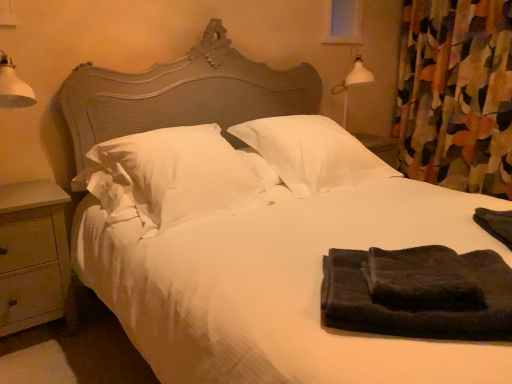
The width and height of the screenshot is (512, 384). What do you see at coordinates (496, 224) in the screenshot?
I see `dark green towel at right, the 2th material in the front-to-back sequence` at bounding box center [496, 224].

Find the location of a particular element. The width and height of the screenshot is (512, 384). wooden at left is located at coordinates (34, 256).

Locate an element on the screen. The height and width of the screenshot is (384, 512). dark green towel at right, which appears as the 1th material when viewed from the back is located at coordinates (496, 224).

Would you say transparent glass window screen at upper center contains white soft pillow at center, which appears as the 2th pillow when viewed from the left?

No, white soft pillow at center, which appears as the 2th pillow when viewed from the left, is not inside transparent glass window screen at upper center.

Which is more to the left, transparent glass window screen at upper center or white soft pillow at center, which appears as the first pillow when viewed from the right?

From the viewer's perspective, white soft pillow at center, which appears as the first pillow when viewed from the right, appears more on the left side.

From a real-world perspective, is transparent glass window screen at upper center physically located above or below white soft pillow at center, which appears as the first pillow when viewed from the right?

transparent glass window screen at upper center is above white soft pillow at center, which appears as the first pillow when viewed from the right.

From the image's perspective, which one is positioned lower, floral fabric curtain at right or dark green towel at right, acting as the 1th material starting from the right?

dark green towel at right, acting as the 1th material starting from the right, from the image's perspective.

Locate an element on the screen. curtain behind the dark green towel at right, the 2th material in the front-to-back sequence is located at coordinates (456, 94).

Looking at the image, does floral fabric curtain at right seem bigger or smaller compared to dark green towel at right, the 2th material in the front-to-back sequence?

Clearly, floral fabric curtain at right is larger in size than dark green towel at right, the 2th material in the front-to-back sequence.

Does floral fabric curtain at right lie in front of dark green towel at right, which is counted as the 2th material, starting from the left?

No, it is not.

What's the angular difference between black terry towel at lower right, marked as the 2th material in a back-to-front arrangement, and floral fabric curtain at right's facing directions?

black terry towel at lower right, marked as the 2th material in a back-to-front arrangement, and floral fabric curtain at right are facing 42.5 degrees away from each other.

Which is more to the right, black terry towel at lower right, which is the first material from front to back, or floral fabric curtain at right?

floral fabric curtain at right.

Which is behind, point (466, 332) or point (438, 148)?

The point (438, 148) is behind.

This screenshot has height=384, width=512. I want to click on curtain located on the right of black terry towel at lower right, arranged as the first material when viewed from the left, so click(456, 94).

Can you confirm if white soft pillow at center, which appears as the first pillow when viewed from the right, is taller than dark green towel at right, which is counted as the 2th material, starting from the left?

Correct, white soft pillow at center, which appears as the first pillow when viewed from the right, is much taller as dark green towel at right, which is counted as the 2th material, starting from the left.

Is white soft pillow at center, which appears as the first pillow when viewed from the right, to the left of dark green towel at right, which appears as the 1th material when viewed from the back, from the viewer's perspective?

Yes.

Does point (306, 115) come in front of point (497, 227)?

No, it is behind (497, 227).

Can you confirm if white soft pillow at center, the second pillow positioned from the right, is thinner than wooden at left?

In fact, white soft pillow at center, the second pillow positioned from the right, might be wider than wooden at left.

Looking at the image, does white soft pillow at center, which is the first pillow from left to right, seem bigger or smaller compared to wooden at left?

white soft pillow at center, which is the first pillow from left to right, is bigger than wooden at left.

Visually, is white soft pillow at center, the second pillow positioned from the right, positioned to the left or to the right of wooden at left?

Clearly, white soft pillow at center, the second pillow positioned from the right, is on the right of wooden at left in the image.

From the wooden at left, count 1st pillow to the right and point to it. Please provide its 2D coordinates.

[(174, 176)]

Are floral fabric curtain at right and wooden at left beside each other?

No, floral fabric curtain at right is not touching wooden at left.

In the scene shown: How far apart are floral fabric curtain at right and wooden at left?

2.72 meters.

Consider the image. Considering the sizes of objects floral fabric curtain at right and wooden at left in the image provided, who is bigger, floral fabric curtain at right or wooden at left?

Bigger between the two is floral fabric curtain at right.

Can you confirm if floral fabric curtain at right is thinner than wooden at left?

Indeed, floral fabric curtain at right has a lesser width compared to wooden at left.

Considering the sizes of objects white soft pillow at center, which appears as the first pillow when viewed from the right, and white soft pillow at center, the second pillow positioned from the right, in the image provided, who is shorter, white soft pillow at center, which appears as the first pillow when viewed from the right, or white soft pillow at center, the second pillow positioned from the right,?

white soft pillow at center, the second pillow positioned from the right.

Between point (269, 145) and point (177, 162), which one is positioned behind?

Point (269, 145)

Between white soft pillow at center, which appears as the first pillow when viewed from the right, and white soft pillow at center, the second pillow positioned from the right, which one has larger size?

white soft pillow at center, the second pillow positioned from the right.

Are white soft pillow at center, which appears as the first pillow when viewed from the right, and white soft pillow at center, which is the first pillow from left to right, making contact?

No, white soft pillow at center, which appears as the first pillow when viewed from the right, is not making contact with white soft pillow at center, which is the first pillow from left to right.

You are a GUI agent. You are given a task and a screenshot of the screen. Output one action in this format:
    pyautogui.click(x=<x>, y=<y>)
    Task: Click on the window screen lying on the right of white soft pillow at center, which appears as the first pillow when viewed from the right
    The height and width of the screenshot is (384, 512).
    Given the screenshot: What is the action you would take?
    pyautogui.click(x=343, y=22)

This screenshot has height=384, width=512. Identify the location of the 1st material counting from the left side of the floral fabric curtain at right. (496, 224).

When comparing their distances from black terry towel at lower right, which is the first material from front to back, does dark green towel at right, the 2th material in the front-to-back sequence, or transparent glass window screen at upper center seem further?

transparent glass window screen at upper center is positioned further to the anchor black terry towel at lower right, which is the first material from front to back.

In the scene shown: Considering their positions, is white soft pillow at center, which appears as the 2th pillow when viewed from the left, positioned closer to dark green towel at right, which appears as the 1th material when viewed from the back, than wooden at left?

white soft pillow at center, which appears as the 2th pillow when viewed from the left.

Considering their positions, is white soft pillow at center, the second pillow positioned from the right, positioned further to black terry towel at lower right, marked as the 2th material in a back-to-front arrangement, than floral fabric curtain at right?

floral fabric curtain at right is positioned further to the anchor black terry towel at lower right, marked as the 2th material in a back-to-front arrangement.

From the image, which object appears to be farther from wooden at left, black terry towel at lower right, which is the first material from front to back, or floral fabric curtain at right?

floral fabric curtain at right is positioned further to the anchor wooden at left.

Looking at the image, which one is located further to transparent glass window screen at upper center, black terry towel at lower right, the second material from the right, or floral fabric curtain at right?

black terry towel at lower right, the second material from the right, is further to transparent glass window screen at upper center.

From the image, which object appears to be farther from black terry towel at lower right, the second material from the right, dark green towel at right, the 2th material in the front-to-back sequence, or floral fabric curtain at right?

Based on the image, floral fabric curtain at right appears to be further to black terry towel at lower right, the second material from the right.

When comparing their distances from dark green towel at right, the 2th material in the front-to-back sequence, does wooden at left or black terry towel at lower right, which is the first material from front to back, seem closer?

black terry towel at lower right, which is the first material from front to back, lies closer to dark green towel at right, the 2th material in the front-to-back sequence, than the other object.

Considering their positions, is white soft pillow at center, which appears as the 2th pillow when viewed from the left, positioned further to white soft pillow at center, the second pillow positioned from the right, than wooden at left?

Based on the image, wooden at left appears to be further to white soft pillow at center, the second pillow positioned from the right.

Locate an element on the screen. window screen between white soft pillow at center, which is the first pillow from left to right, and floral fabric curtain at right, in the horizontal direction is located at coordinates (343, 22).

Find the location of a particular element. This screenshot has width=512, height=384. curtain located between dark green towel at right, which is counted as the 2th material, starting from the left, and transparent glass window screen at upper center in the depth direction is located at coordinates (456, 94).

You are a GUI agent. You are given a task and a screenshot of the screen. Output one action in this format:
    pyautogui.click(x=<x>, y=<y>)
    Task: Click on the pillow located between wooden at left and white soft pillow at center, which appears as the 2th pillow when viewed from the left, in the left-right direction
    Image resolution: width=512 pixels, height=384 pixels.
    Given the screenshot: What is the action you would take?
    pyautogui.click(x=174, y=176)

In order to click on pillow between white soft pillow at center, the second pillow positioned from the right, and floral fabric curtain at right, in the horizontal direction in this screenshot , I will do `click(312, 153)`.